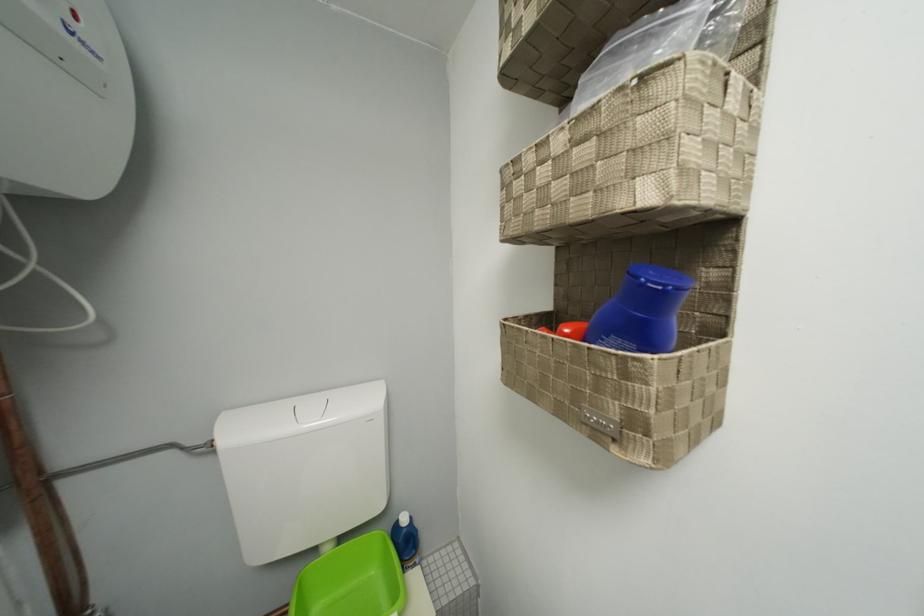
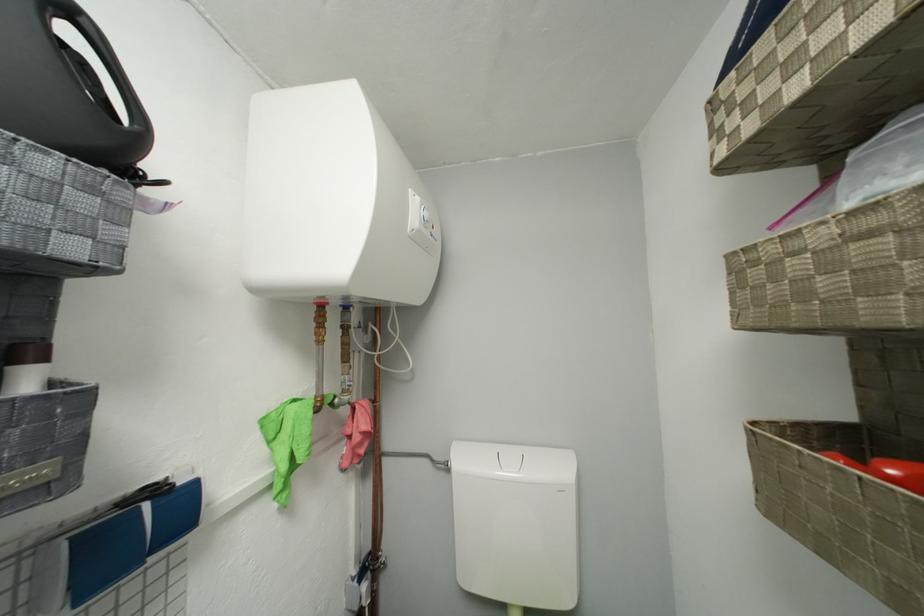
Locate, in the second image, the point that corresponds to [576,333] in the first image.

(903, 475)